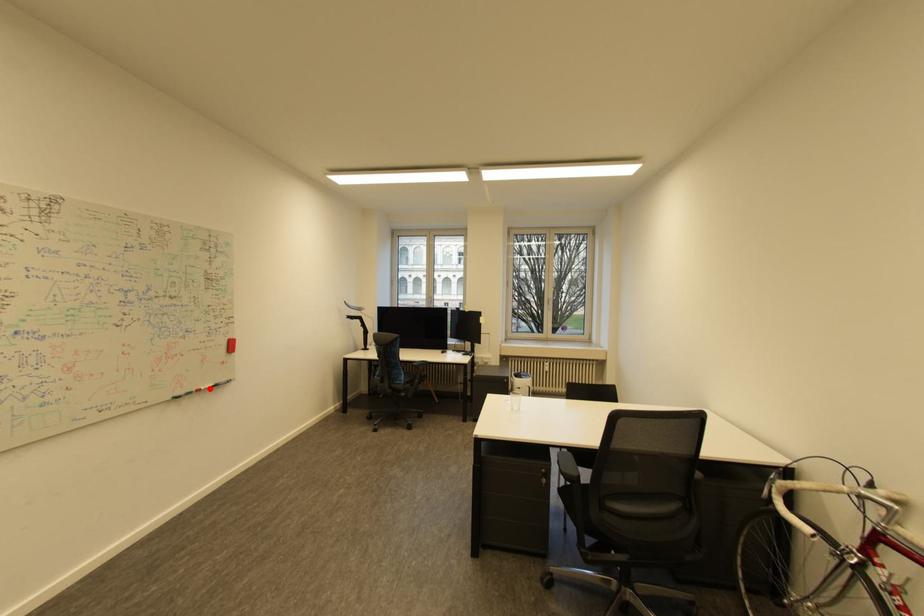
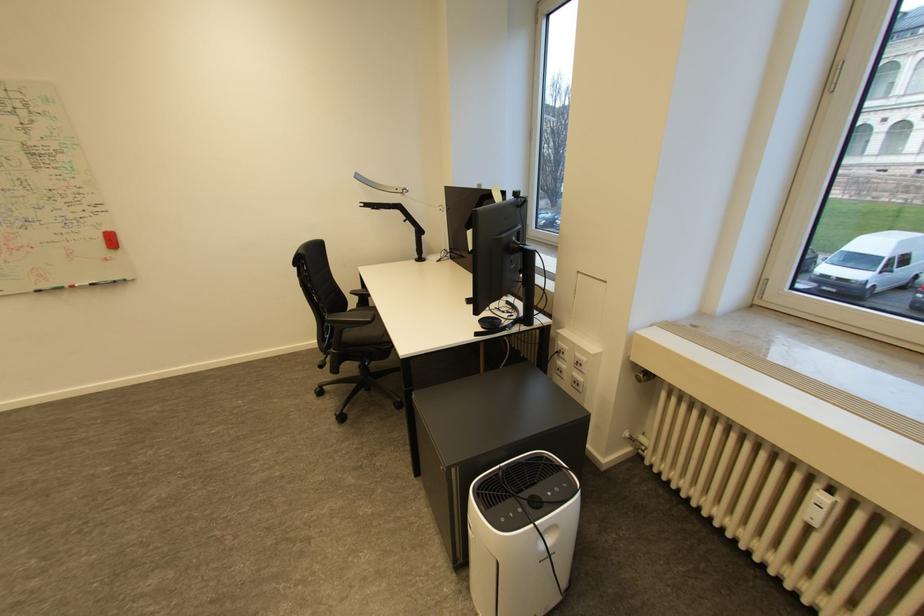
Where in the second image is the point corresponding to the highlighted location from the first image?

(83, 286)